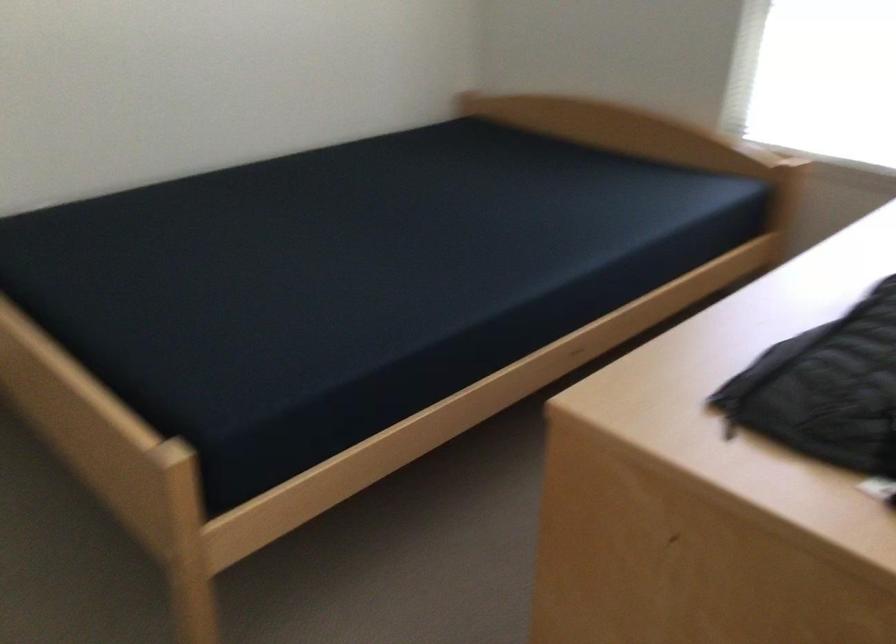
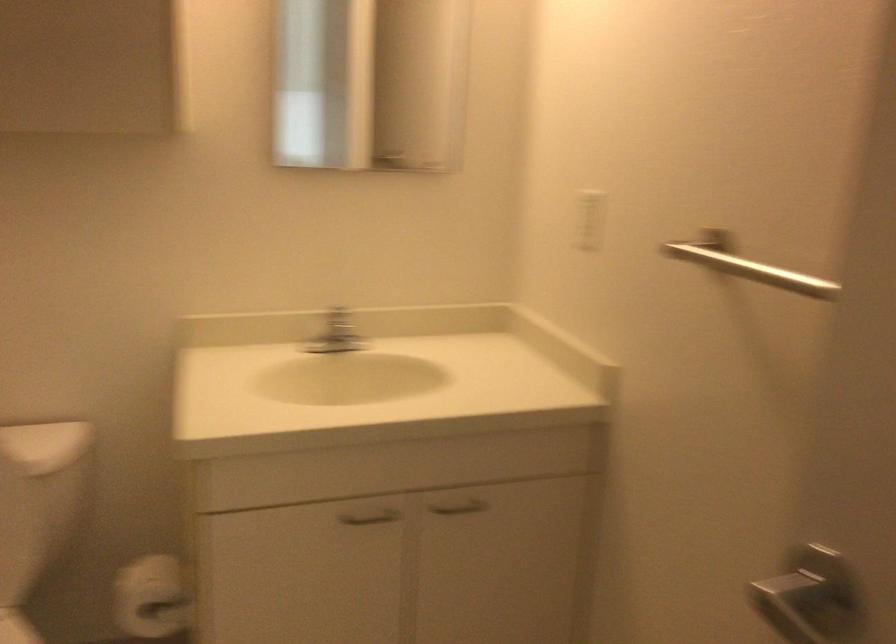
The images are taken continuously from a first-person perspective. In which direction are you moving?

The cameraman moved toward left, backward.